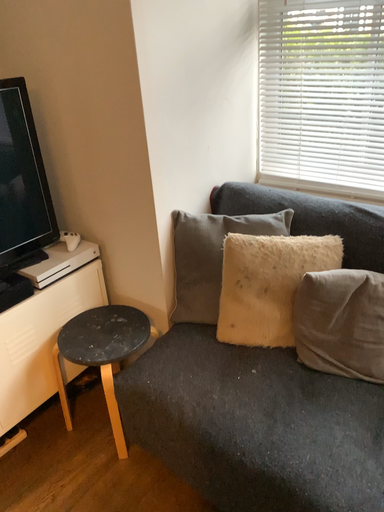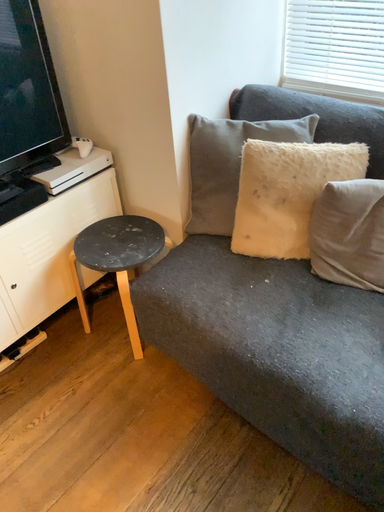
Question: How did the camera likely rotate when shooting the video?

Choices:
 (A) rotated downward
 (B) rotated upward

Answer: (A)